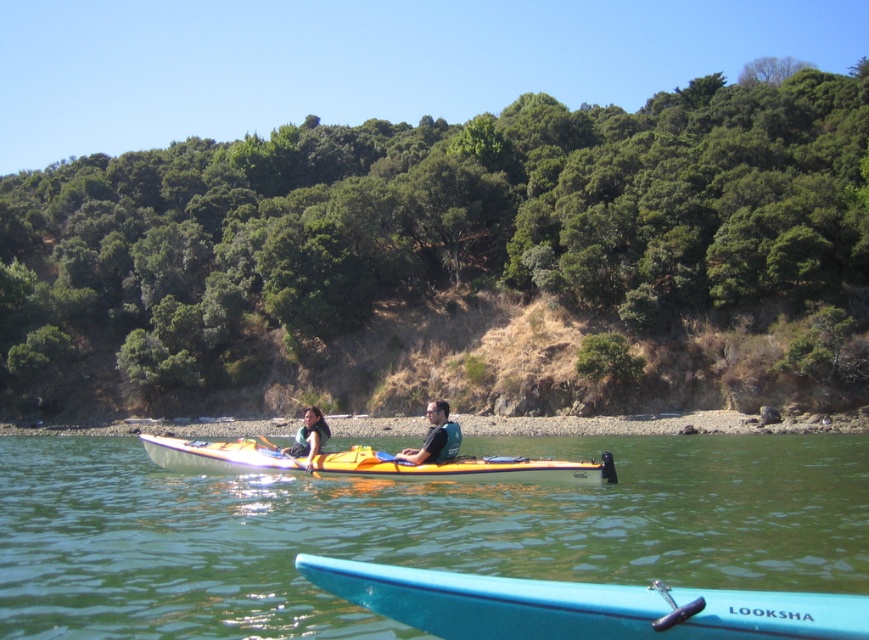
You are planning to store the blue plastic canoe at lower center and the matte blue life vest at center in a vertical storage rack. Which item should you place at the bottom to ensure stability?

The blue plastic canoe at lower center should be placed at the bottom of the storage rack because it has a lesser height compared to the matte blue life vest at center, making it more stable as a base.

You are a photographer trying to capture a clear image of the orange kayak at center and the matte blue life vest at center. Since you want to focus on the kayak, which object should you zoom in on more to ensure it appears bigger in your photo?

The orange kayak at center is larger than the matte blue life vest at center, so you should zoom in on the orange kayak at center to make it appear bigger in the photo.

You are planning to store the orange kayak at center and the matte blue life vest at center in a vertical storage rack. Which item should be placed first to fit both items properly?

The matte blue life vest at center should be placed first since the orange kayak at center is much taller and would require more vertical space. By placing the shorter matte blue life vest at center first, there will be enough room to accommodate the taller orange kayak at center above it.